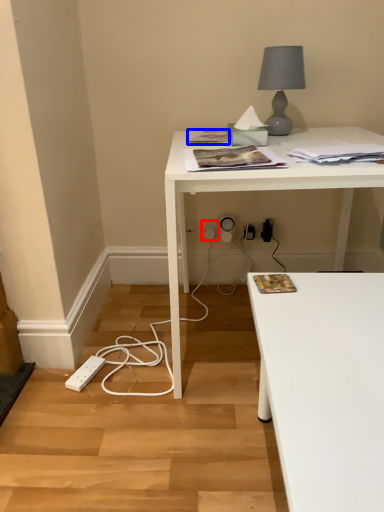
Question: Which object appears farthest to the camera in this image, electric outlet (highlighted by a red box) or magazine (highlighted by a blue box)?

Choices:
 (A) electric outlet
 (B) magazine

Answer: (A)